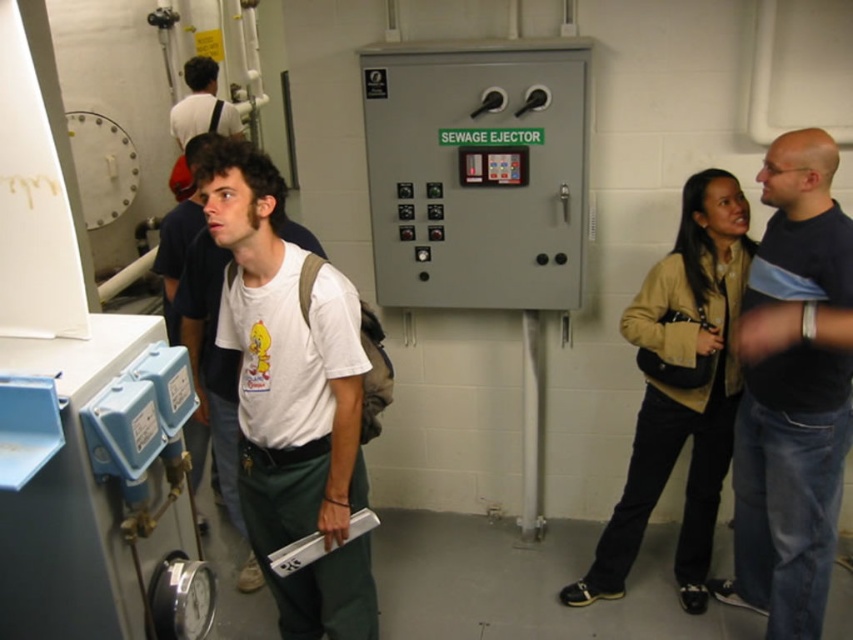
Which of these two, white cotton t-shirt at center or white matte shirt at upper left, stands taller?

white cotton t-shirt at center is taller.

Does white cotton t-shirt at center lie behind white matte shirt at upper left?

That is False.

Which is behind, point (361, 605) or point (194, 106)?

Point (194, 106)

Identify the location of white cotton t-shirt at center. The width and height of the screenshot is (853, 640). (291, 397).

Can you confirm if white matte shirt at upper left is shorter than silver metallic tray at center?

In fact, white matte shirt at upper left may be taller than silver metallic tray at center.

Who is shorter, white matte shirt at upper left or silver metallic tray at center?

Standing shorter between the two is silver metallic tray at center.

What do you see at coordinates (202, 104) in the screenshot? The height and width of the screenshot is (640, 853). I see `white matte shirt at upper left` at bounding box center [202, 104].

The height and width of the screenshot is (640, 853). In order to click on white matte shirt at upper left in this screenshot , I will do `click(202, 104)`.

Is dark blue t-shirt at upper right to the left of white matte shirt at upper left from the viewer's perspective?

In fact, dark blue t-shirt at upper right is to the right of white matte shirt at upper left.

Can you confirm if dark blue t-shirt at upper right is taller than white matte shirt at upper left?

Indeed, dark blue t-shirt at upper right has a greater height compared to white matte shirt at upper left.

Is point (838, 209) more distant than point (212, 81)?

That is False.

You are a GUI agent. You are given a task and a screenshot of the screen. Output one action in this format:
    pyautogui.click(x=<x>, y=<y>)
    Task: Click on the dark blue t-shirt at upper right
    
    Given the screenshot: What is the action you would take?
    pyautogui.click(x=792, y=392)